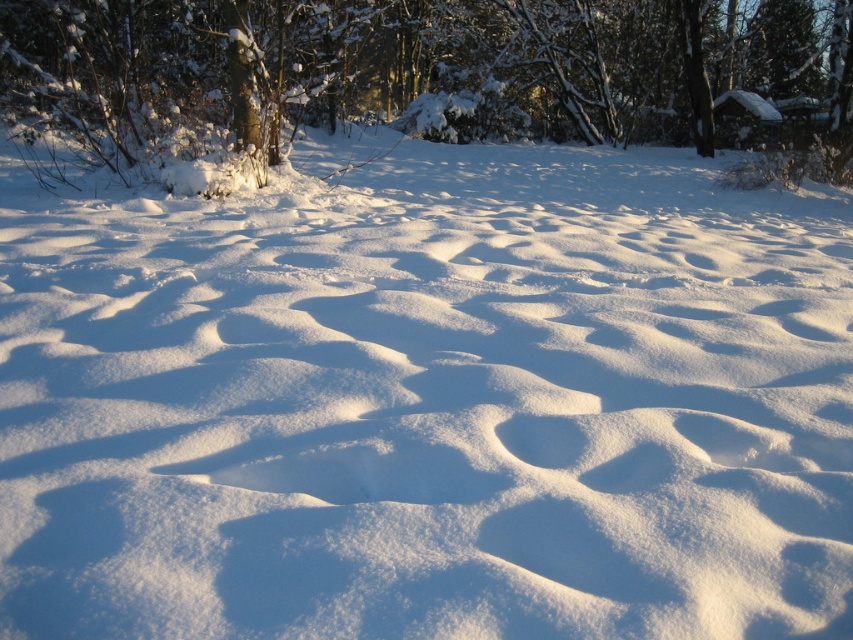
Is snowy bark tree at upper center to the left of white fluffy footprint at center from the viewer's perspective?

No, snowy bark tree at upper center is not to the left of white fluffy footprint at center.

Looking at this image, can you confirm if snowy bark tree at upper center is positioned above white fluffy footprint at center?

Indeed, snowy bark tree at upper center is positioned over white fluffy footprint at center.

Where is `snowy bark tree at upper center`? The image size is (853, 640). snowy bark tree at upper center is located at coordinates (436, 74).